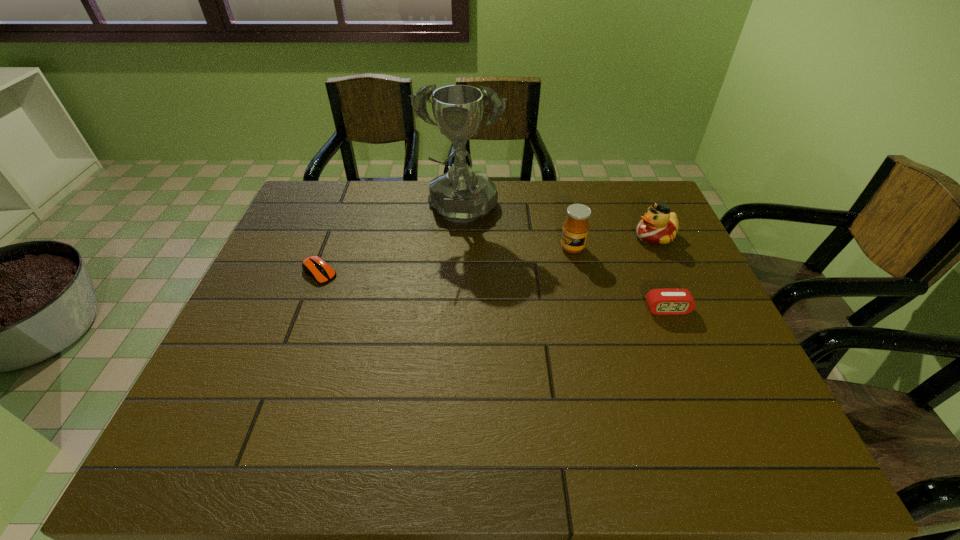
This screenshot has width=960, height=540. Identify the location of object that stands as the second closest to the alarm clock. (658, 226).

I want to click on vacant space that satisfies the following two spatial constraints: 1. on the front side of the award; 2. on the left side of the honey, so click(x=459, y=248).

Find the location of a particular element. Image resolution: width=960 pixels, height=540 pixels. free point that satisfies the following two spatial constraints: 1. on the front side of the second object from left to right; 2. on the left side of the duck is located at coordinates (460, 237).

Identify the location of free location that satisfies the following two spatial constraints: 1. on the front side of the third object from right to left; 2. on the left side of the award. The width and height of the screenshot is (960, 540). (459, 248).